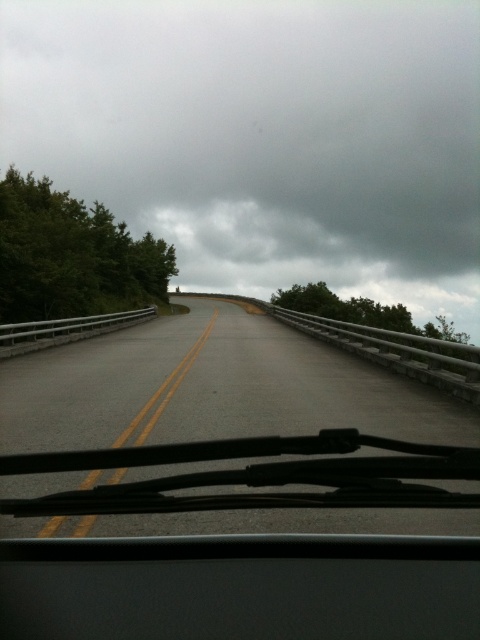
Can you confirm if asphalt road at center is bigger than transparent rubber windshield wipers at bottom?

Correct, asphalt road at center is larger in size than transparent rubber windshield wipers at bottom.

Is asphalt road at center closer to camera compared to transparent rubber windshield wipers at bottom?

Yes, it is.

Consider the image. Who is more forward, (193, 372) or (348, 476)?

Point (348, 476)

Locate an element on the screen. asphalt road at center is located at coordinates (211, 388).